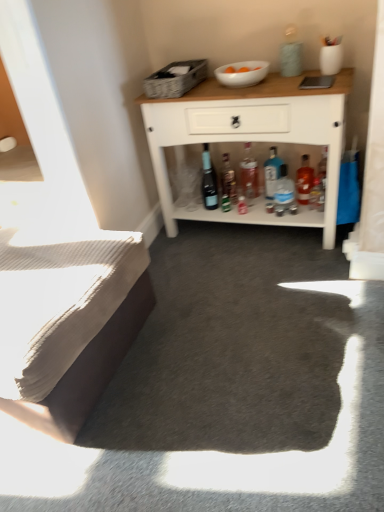
Question: Is blue glass bottle at center, arranged as the third bottle when viewed from the right, inside or outside of white wood cabinet at upper center?

Choices:
 (A) outside
 (B) inside

Answer: (B)

Question: Is blue glass bottle at center, the 4th bottle in the left-to-right sequence, wider or thinner than white wood cabinet at upper center?

Choices:
 (A) wide
 (B) thin

Answer: (B)

Question: Which of these objects is positioned farthest from the translucent glass bottle at center, marked as the first bottle in a right-to-left arrangement?

Choices:
 (A) white glossy bowl at upper center
 (B) white wood cabinet at upper center
 (C) beige textured bed at lower left
 (D) matte glass bottle at center, positioned as the first bottle in left-to-right order
 (E) translucent glass bottle at center, which is counted as the 5th bottle, starting from the right

Answer: (C)

Question: Based on their relative distances, which object is nearer to the matte glass bottle at center, the sixth bottle from the right?

Choices:
 (A) translucent plastic bottle at center, positioned as the 3th bottle in left-to-right order
 (B) blue glass bottle at center, the 4th bottle in the left-to-right sequence
 (C) white wood cabinet at upper center
 (D) woven fabric picnic basket at upper center
 (E) beige textured bed at lower left

Answer: (A)